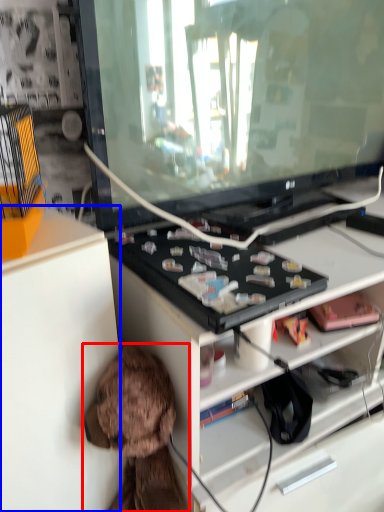
Question: Which of the following is the closest to the observer, toy (highlighted by a red box) or cabinetry (highlighted by a blue box)?

Choices:
 (A) toy
 (B) cabinetry

Answer: (B)